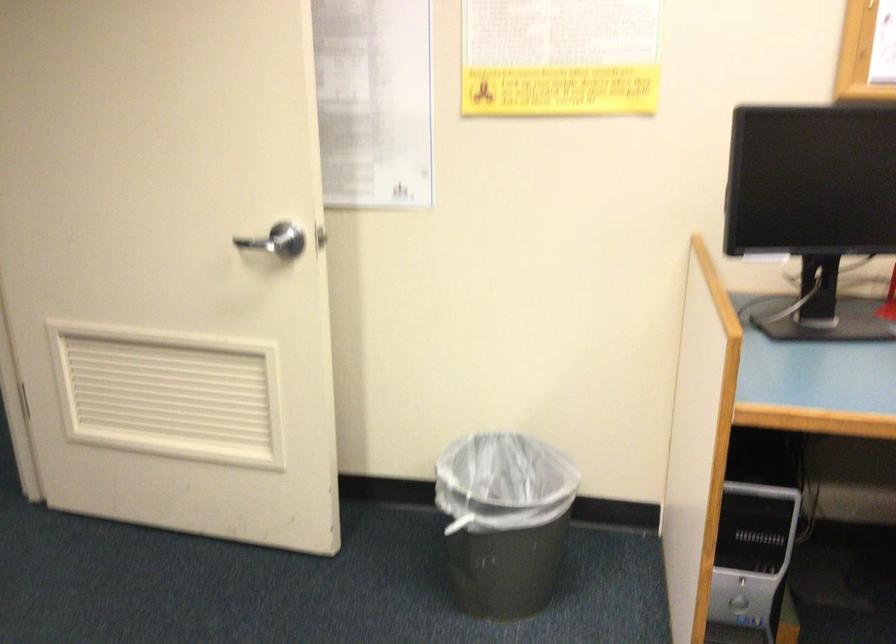
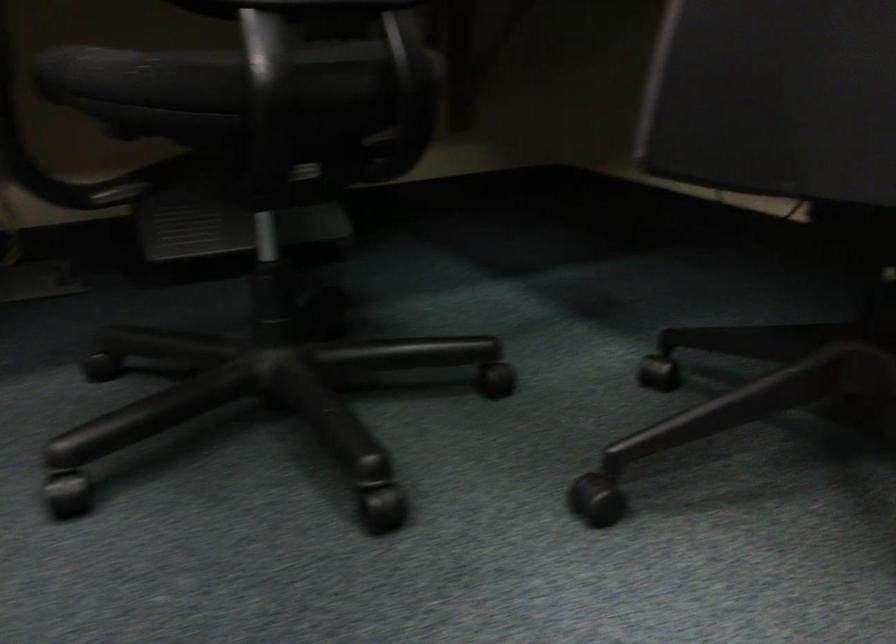
Question: Based on the continuous images, in which direction is the camera rotating? Reply with the corresponding letter.

Choices:
 (A) Left
 (B) Right
 (C) Up
 (D) Down

Answer: (B)